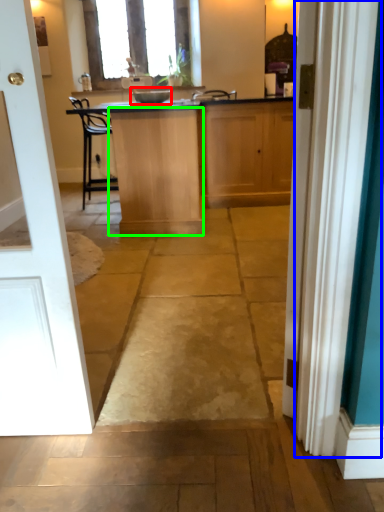
Question: Estimate the real-world distances between objects in this image. Which object is farther from appliance (highlighted by a red box), curtain (highlighted by a blue box) or cabinetry (highlighted by a green box)?

Choices:
 (A) curtain
 (B) cabinetry

Answer: (A)